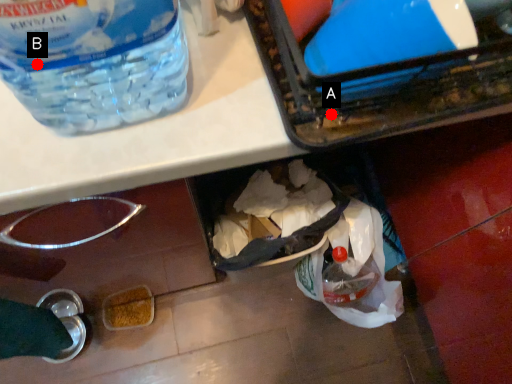
Question: Two points are circled on the image, labeled by A and B beside each circle. Among these points, which one is farthest from the camera?

Choices:
 (A) A is further
 (B) B is further

Answer: (A)